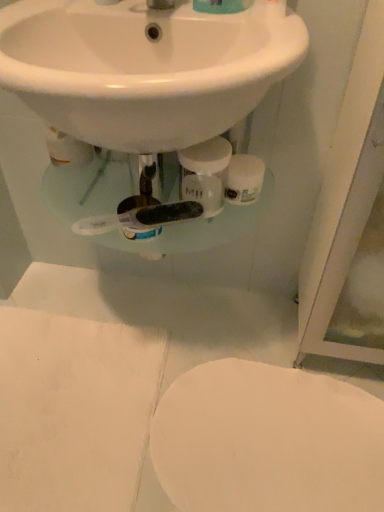
Identify the location of blank area beneath white glossy toilet at lower right (from a real-world perspective). (269, 443).